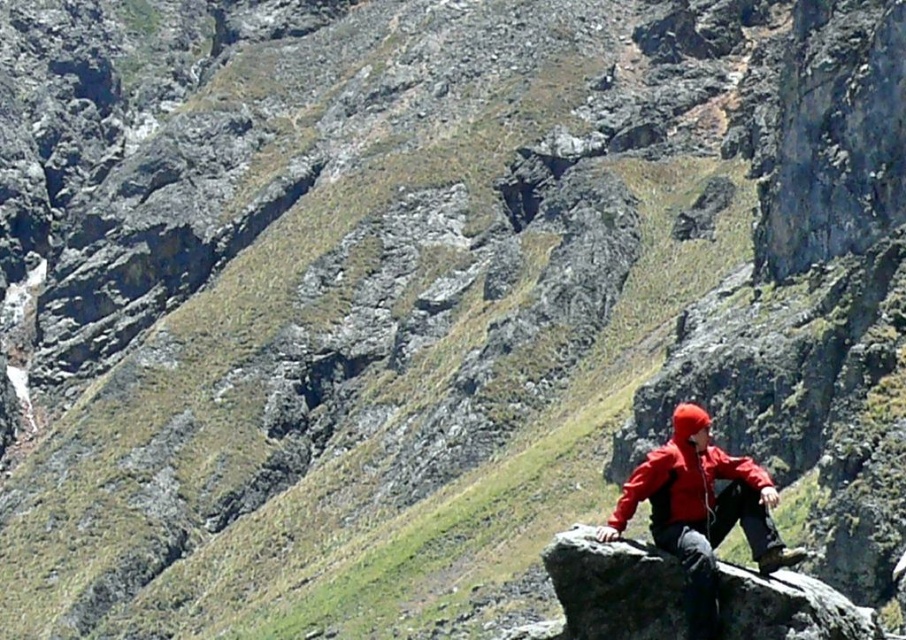
Question: Which of these objects is positioned closest to the matte red jacket at lower right?

Choices:
 (A) smooth rock at center
 (B) red matte jacket at lower right

Answer: (B)

Question: Which point appears closest to the camera in this image?

Choices:
 (A) (736, 580)
 (B) (758, 467)
 (C) (677, 500)

Answer: (A)

Question: Does smooth rock at center appear over red matte jacket at lower right?

Choices:
 (A) yes
 (B) no

Answer: (B)

Question: Estimate the real-world distances between objects in this image. Which object is closer to the red matte jacket at lower right?

Choices:
 (A) smooth rock at center
 (B) matte red jacket at lower right

Answer: (B)

Question: Is smooth rock at center above red matte jacket at lower right?

Choices:
 (A) no
 (B) yes

Answer: (A)

Question: Is smooth rock at center thinner than matte red jacket at lower right?

Choices:
 (A) yes
 (B) no

Answer: (A)